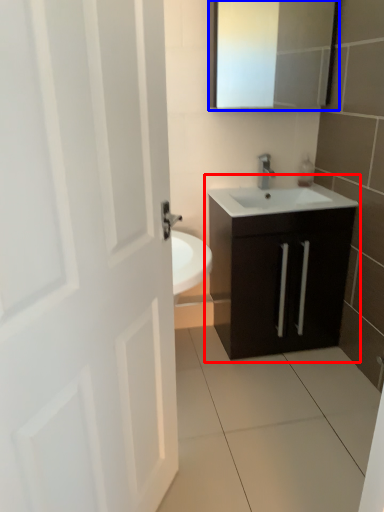
Question: Which object appears closest to the camera in this image, bathroom cabinet (highlighted by a red box) or medicine cabinet (highlighted by a blue box)?

Choices:
 (A) bathroom cabinet
 (B) medicine cabinet

Answer: (A)